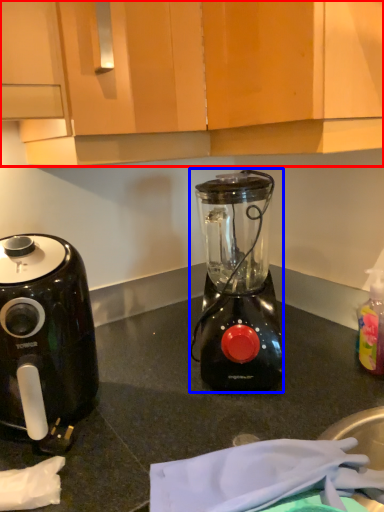
Question: Which object appears closest to the camera in this image, cabinetry (highlighted by a red box) or blender (highlighted by a blue box)?

Choices:
 (A) cabinetry
 (B) blender

Answer: (A)